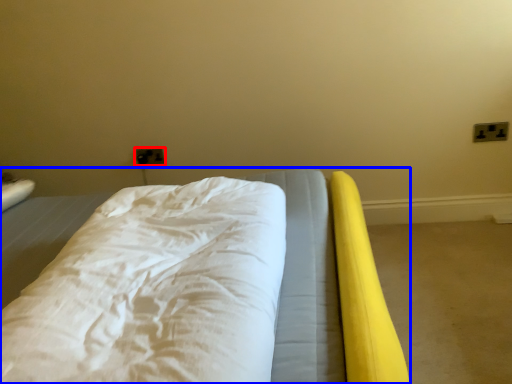
Question: Which object is closer to the camera taking this photo, electric outlet (highlighted by a red box) or bed (highlighted by a blue box)?

Choices:
 (A) electric outlet
 (B) bed

Answer: (B)